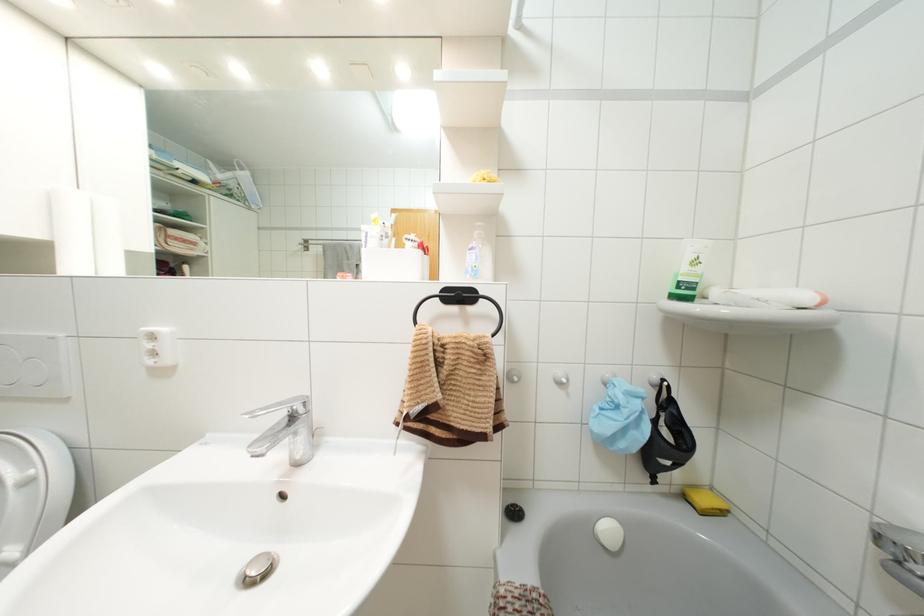
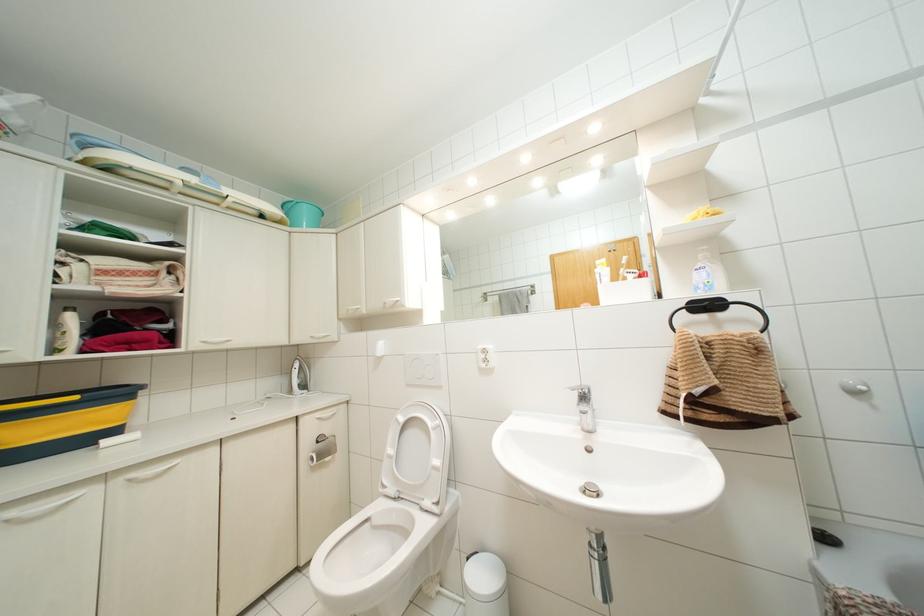
Locate, in the second image, the point that corresponds to [482,172] in the first image.

(701, 208)